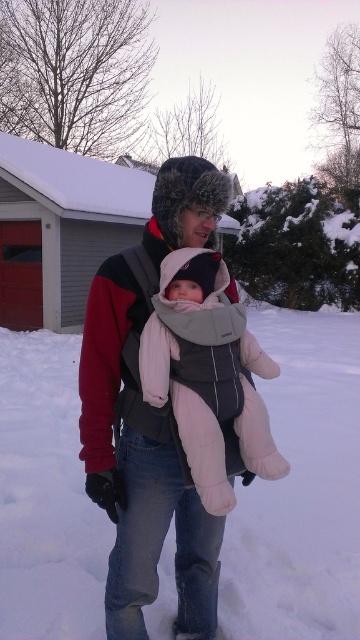
Is gray fleece jacket at center wider than light pink fleece baby carrier at center?

Correct, the width of gray fleece jacket at center exceeds that of light pink fleece baby carrier at center.

Is point (115, 573) positioned after point (240, 428)?

That is True.

Find the location of a particular element. This screenshot has width=360, height=640. gray fleece jacket at center is located at coordinates (138, 472).